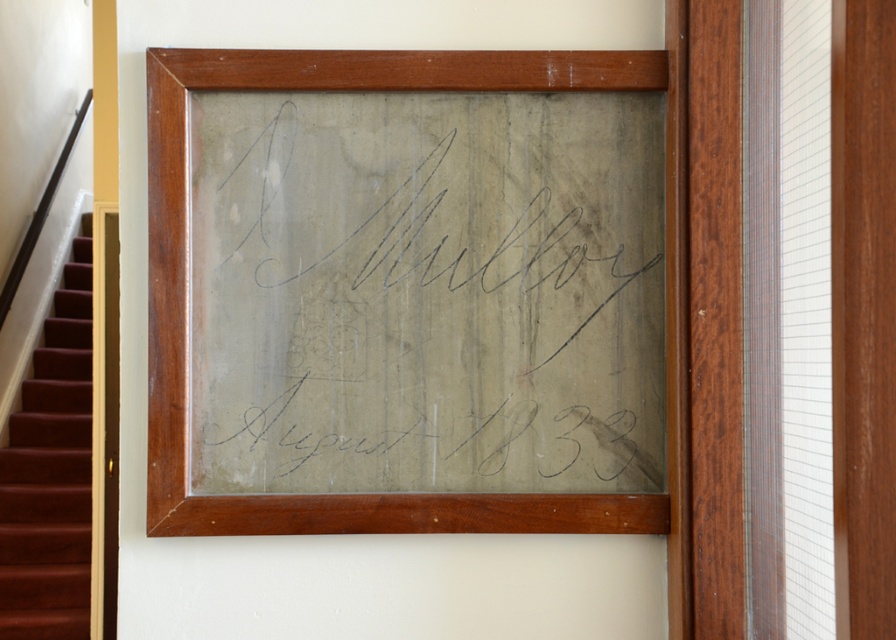
You are an art conservator examining the framed glass piece. You notice a specific point on the glass where something is attached. What is located at the point marked as point (427,292)?

At point (427,292) lies matte gray paper at center.

You are standing at the base of the maroon carpeted stairs at left and want to place a 4 meter long banner on the floor leading towards the matte gray paper at center. Will the banner fit without overlapping the stairs?

The matte gray paper at center is 3.59 meters away from the maroon carpeted stairs at left. Since the banner is 4 meters long, it will extend beyond the distance between them, causing overlap with the stairs. Therefore, the banner will not fit without overlapping the stairs.